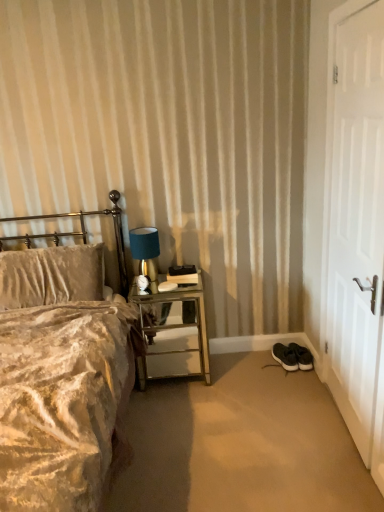
This screenshot has width=384, height=512. I want to click on free space to the left of white matte door at right, so [x=280, y=421].